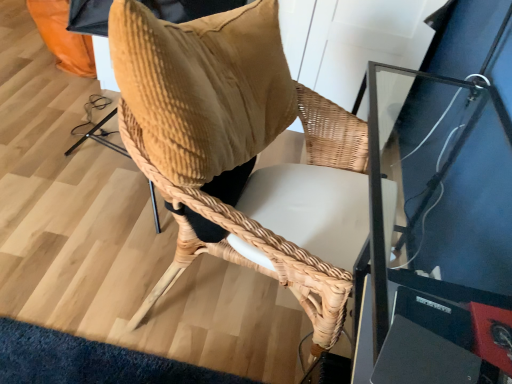
Image resolution: width=512 pixels, height=384 pixels. What are the coordinates of `vacant location below woven wood chair at center (from a real-world perspective)` in the screenshot? It's located at (234, 311).